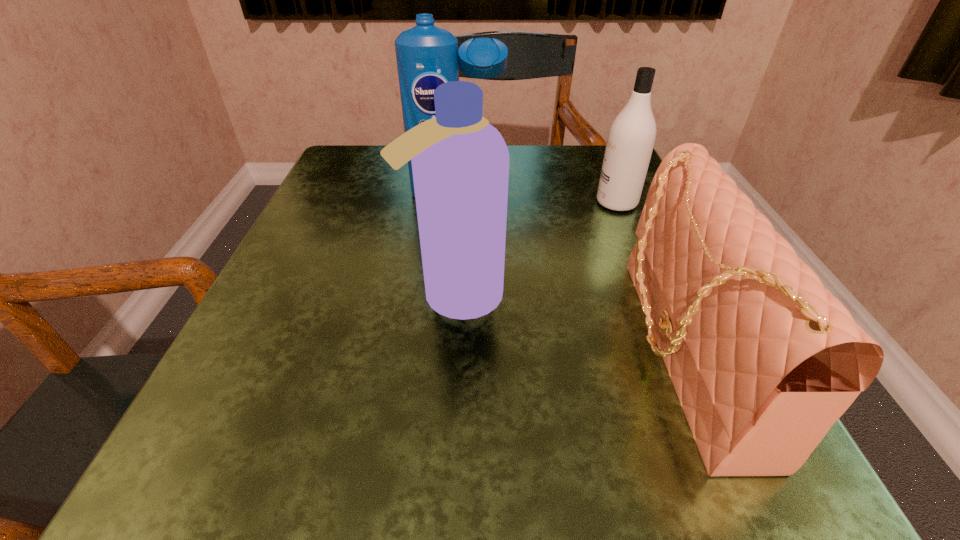
At what (x,y) coordinates should I click in order to perform the action: click on object that is at the near edge. Please return your answer as a coordinate pair (x, y). The image size is (960, 540). Looking at the image, I should click on (764, 360).

Locate an element on the screen. shampoo positioned at the right edge is located at coordinates (631, 137).

This screenshot has width=960, height=540. I want to click on handbag that is at the right edge, so click(764, 360).

Where is `object that is at the far right corner`? Image resolution: width=960 pixels, height=540 pixels. object that is at the far right corner is located at coordinates (631, 137).

Locate an element on the screen. object present at the near right corner is located at coordinates (764, 360).

Where is `free location at the far edge`? Image resolution: width=960 pixels, height=540 pixels. free location at the far edge is located at coordinates (545, 163).

Find the location of a particular element. free space at the right edge is located at coordinates point(608,277).

In order to click on vacant space at the far left corner of the desktop in this screenshot , I will do `click(334, 174)`.

At what (x,y) coordinates should I click in order to perform the action: click on free region at the near left corner. Please return your answer as a coordinate pair (x, y). Looking at the image, I should click on (291, 467).

Find the location of a particular element. This screenshot has height=540, width=960. vacant region at the far right corner is located at coordinates (573, 191).